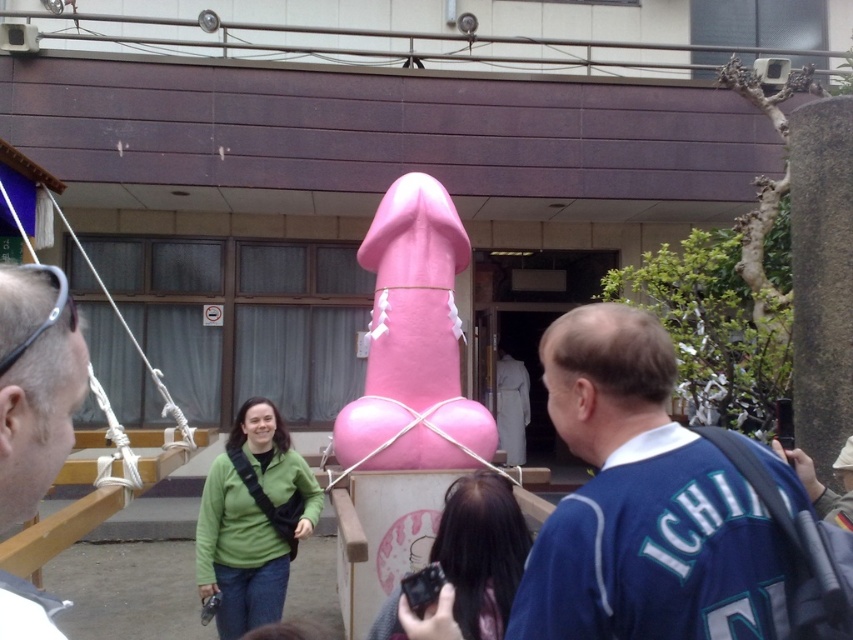
Question: Is matte black sunglasses at left wider than green fabric jacket at center?

Choices:
 (A) no
 (B) yes

Answer: (A)

Question: Can you confirm if matte black sunglasses at left is positioned to the right of green matte jacket at center?

Choices:
 (A) no
 (B) yes

Answer: (B)

Question: Which of these objects is positioned farthest from the matte black sunglasses at left?

Choices:
 (A) blue jersey at center
 (B) pink matte balloon at center

Answer: (B)

Question: Which point is closer to the camera?

Choices:
 (A) (13, 621)
 (B) (631, 566)
 (C) (375, 412)
 (D) (485, 512)

Answer: (A)

Question: Which object is closer to the camera taking this photo?

Choices:
 (A) green matte jacket at center
 (B) green fabric jacket at center
 (C) pink matte balloon at center

Answer: (B)

Question: Observing the image, what is the correct spatial positioning of matte black sunglasses at left in reference to green fabric jacket at center?

Choices:
 (A) right
 (B) left

Answer: (B)